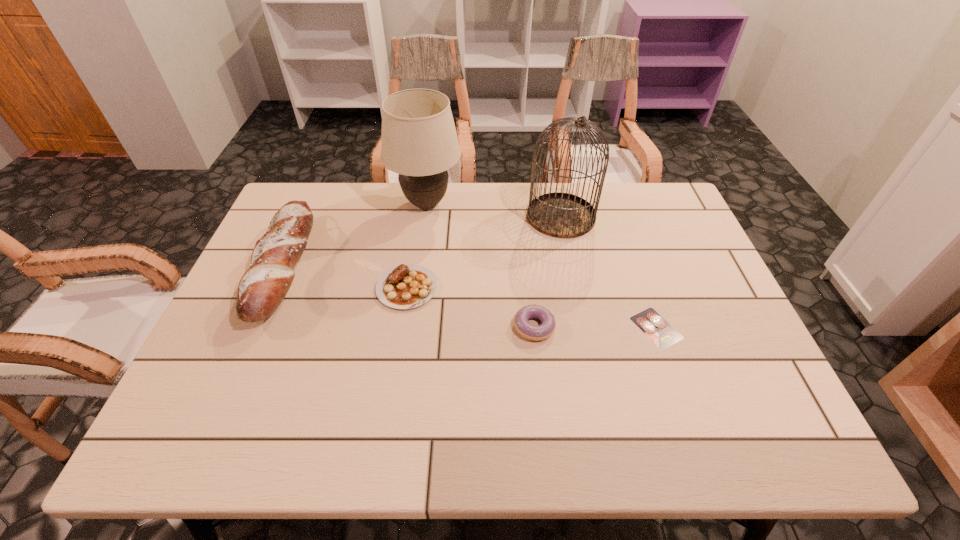
This screenshot has height=540, width=960. I want to click on vacant space positioned 0.270m on the right of the baguet, so click(x=403, y=266).

The image size is (960, 540). I want to click on vacant point located 0.170m on the back of the doughnut, so click(x=527, y=264).

Find the location of a particular element. free location located 0.190m on the right of the steak is located at coordinates (509, 288).

The image size is (960, 540). I want to click on vacant space located 0.160m on the left of the shortest object, so click(x=568, y=328).

What are the coordinates of `lampshade present at the far edge` in the screenshot? It's located at (419, 141).

Identify the location of birdcage that is at the far edge. (561, 215).

I want to click on baguet that is at the far edge, so click(264, 285).

Where is `object located at the left edge`? Image resolution: width=960 pixels, height=540 pixels. object located at the left edge is located at coordinates (264, 285).

Identify the location of object that is at the right edge. The height and width of the screenshot is (540, 960). (653, 325).

The height and width of the screenshot is (540, 960). What are the coordinates of `object that is positioned at the far left corner` in the screenshot? It's located at (264, 285).